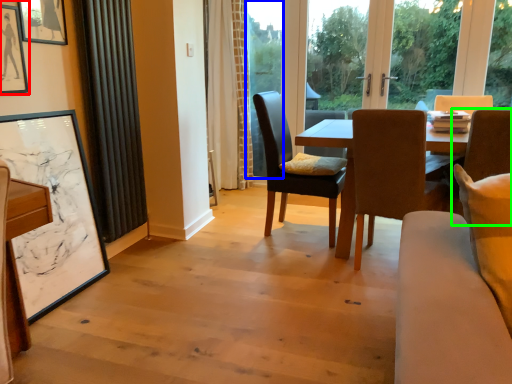
Question: Which object is positioned farthest from picture frame (highlighted by a red box)? Select from window screen (highlighted by a blue box) and chair (highlighted by a green box).

Choices:
 (A) window screen
 (B) chair

Answer: (A)